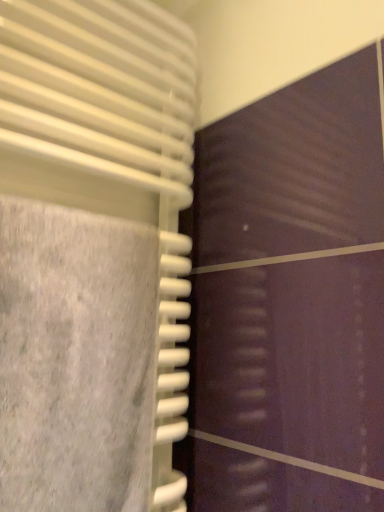
I want to click on white matte curtain at left, so click(x=110, y=151).

The width and height of the screenshot is (384, 512). What do you see at coordinates (110, 151) in the screenshot? I see `white matte curtain at left` at bounding box center [110, 151].

Based on the photo, what is the approximate height of white matte curtain at left?

white matte curtain at left is 3.32 feet in height.

Locate an element on the screen. white matte curtain at left is located at coordinates (110, 151).